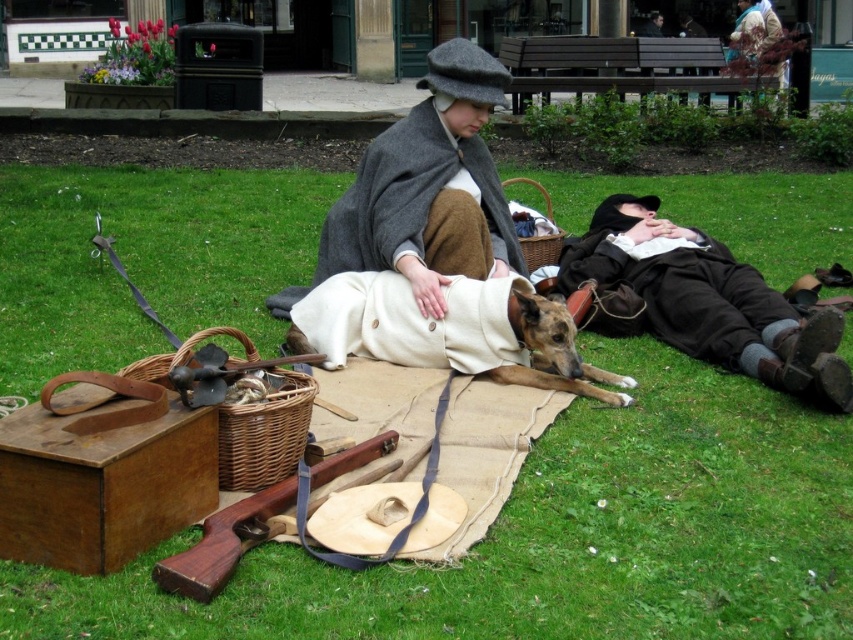
Question: Based on their relative distances, which object is nearer to the green grass at center?

Choices:
 (A) white woolen coat at center
 (B) dark brown leather jacket at right

Answer: (A)

Question: Where is white woolen coat at center located in relation to woven brown picnic basket at upper center in the image?

Choices:
 (A) above
 (B) below

Answer: (B)

Question: Where is dark brown leather jacket at right located in relation to white woolen coat at center in the image?

Choices:
 (A) left
 (B) right

Answer: (B)

Question: Does dark brown leather jacket at right lie in front of wooden rifle at lower left?

Choices:
 (A) no
 (B) yes

Answer: (A)

Question: Which of these objects is positioned farthest from the wooden rifle at lower left?

Choices:
 (A) white woolen coat at center
 (B) dark brown leather jacket at right

Answer: (B)

Question: Among these objects, which one is nearest to the camera?

Choices:
 (A) dark brown leather jacket at right
 (B) wooden rifle at lower left
 (C) white woolen coat at center
 (D) gray woolen cape at center

Answer: (B)